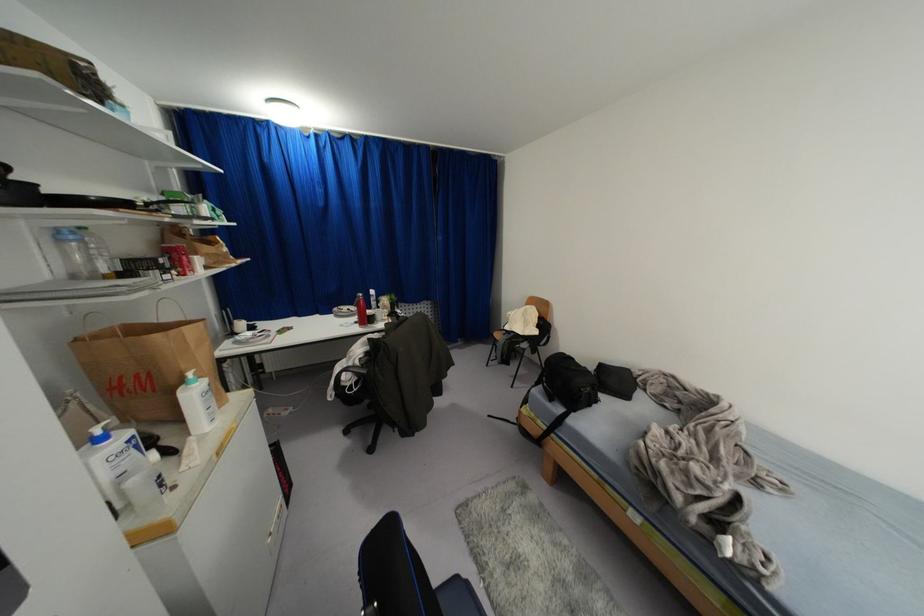
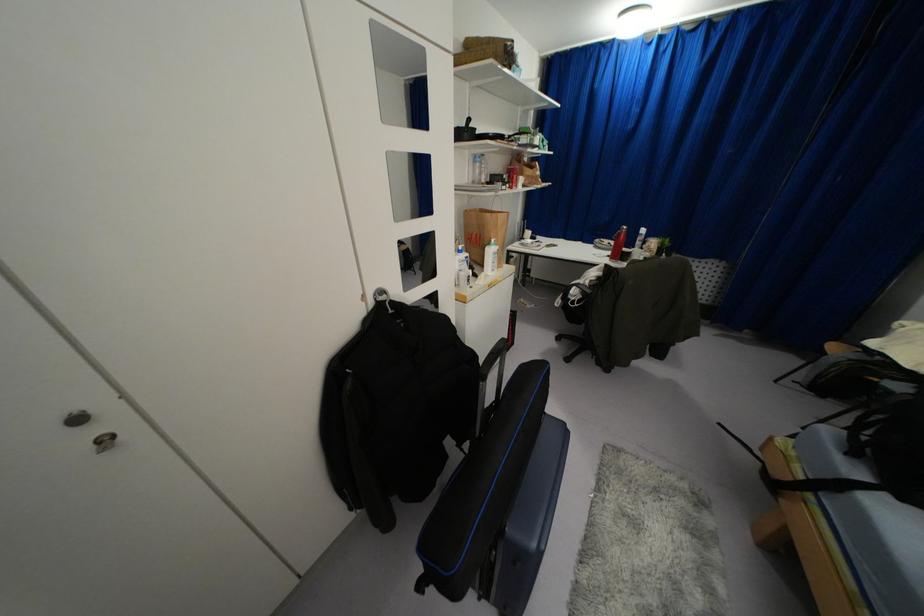
Locate, in the second image, the point that corresponds to (359,301) in the first image.

(618, 233)